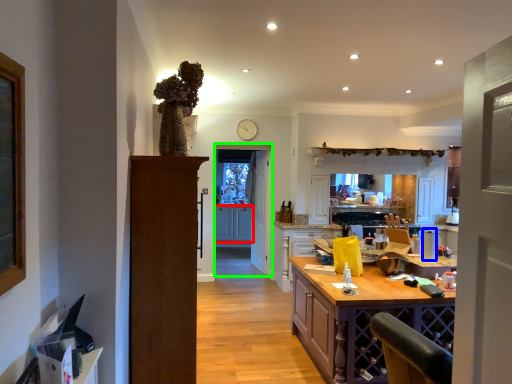
Question: Based on their relative distances, which object is nearer to cabinetry (highlighted by a red box)? Choose from appliance (highlighted by a blue box) and glass door (highlighted by a green box).

Choices:
 (A) appliance
 (B) glass door

Answer: (B)